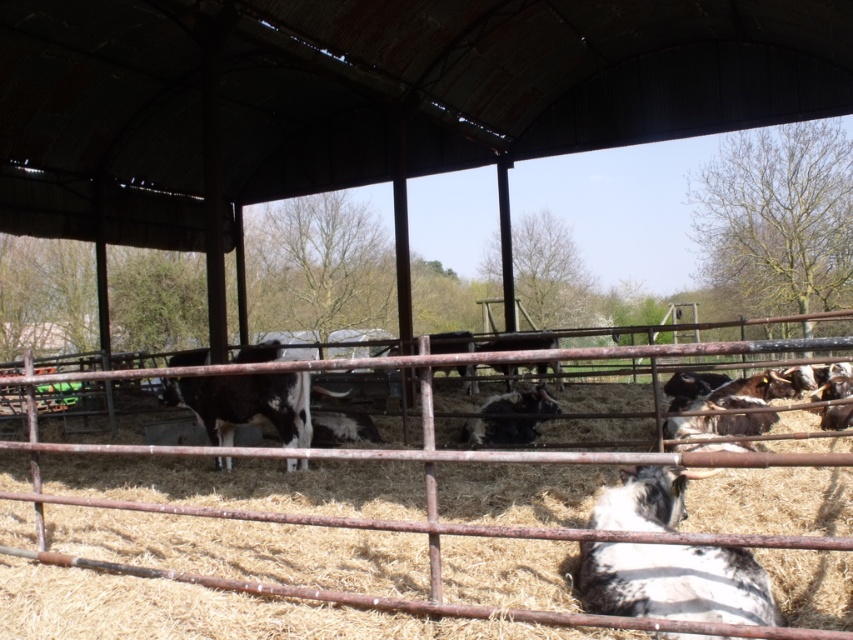
Question: Is rusty metal fence at center thinner than black and white cow at center?

Choices:
 (A) no
 (B) yes

Answer: (A)

Question: Which object is farther from the camera taking this photo?

Choices:
 (A) rusty metal fence at center
 (B) white speckled fur at center
 (C) black and white cow at center

Answer: (C)

Question: Does rusty metal fence at center appear under white speckled fur at center?

Choices:
 (A) no
 (B) yes

Answer: (B)

Question: Is rusty metal fence at center above black and white cow at center?

Choices:
 (A) no
 (B) yes

Answer: (A)

Question: Among these points, which one is farthest from the camera?

Choices:
 (A) (169, 449)
 (B) (524, 420)
 (C) (682, 609)

Answer: (B)

Question: Which point appears closest to the camera in this image?

Choices:
 (A) (364, 529)
 (B) (506, 419)

Answer: (A)